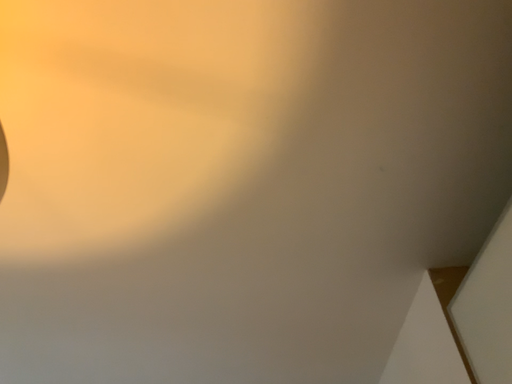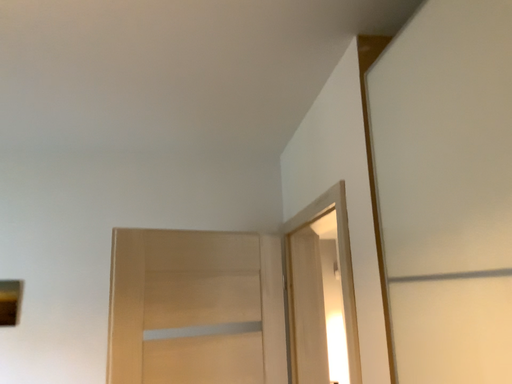
Question: How did the camera likely rotate when shooting the video?

Choices:
 (A) rotated left
 (B) rotated right

Answer: (B)